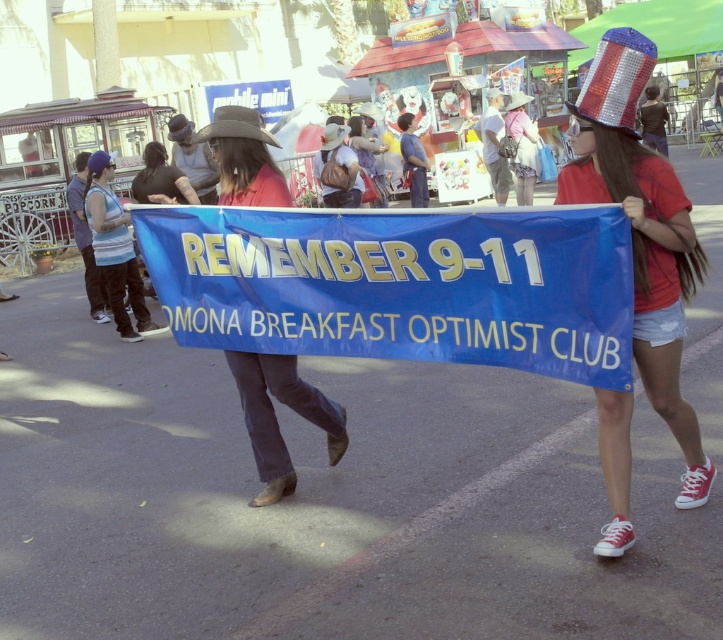
Can you confirm if shiny sequined hat at upper right is positioned to the right of matte red shirt at center?

Correct, you'll find shiny sequined hat at upper right to the right of matte red shirt at center.

Is point (669, 172) behind point (262, 497)?

That is False.

Identify the location of shiny sequined hat at upper right. This screenshot has height=640, width=723. click(641, 230).

Is blue fabric banner at center to the left of shiny sequined hat at upper right from the viewer's perspective?

Yes, blue fabric banner at center is to the left of shiny sequined hat at upper right.

The image size is (723, 640). What do you see at coordinates (401, 284) in the screenshot?
I see `blue fabric banner at center` at bounding box center [401, 284].

The image size is (723, 640). I want to click on blue fabric banner at center, so click(401, 284).

Between blue fabric banner at center and matte red shirt at center, which one is positioned higher?

blue fabric banner at center is higher up.

Can you confirm if blue fabric banner at center is positioned above matte red shirt at center?

Yes, blue fabric banner at center is above matte red shirt at center.

Who is more forward, [474,298] or [291,380]?

Point [474,298] is more forward.

Identify the location of blue fabric banner at center. (401, 284).